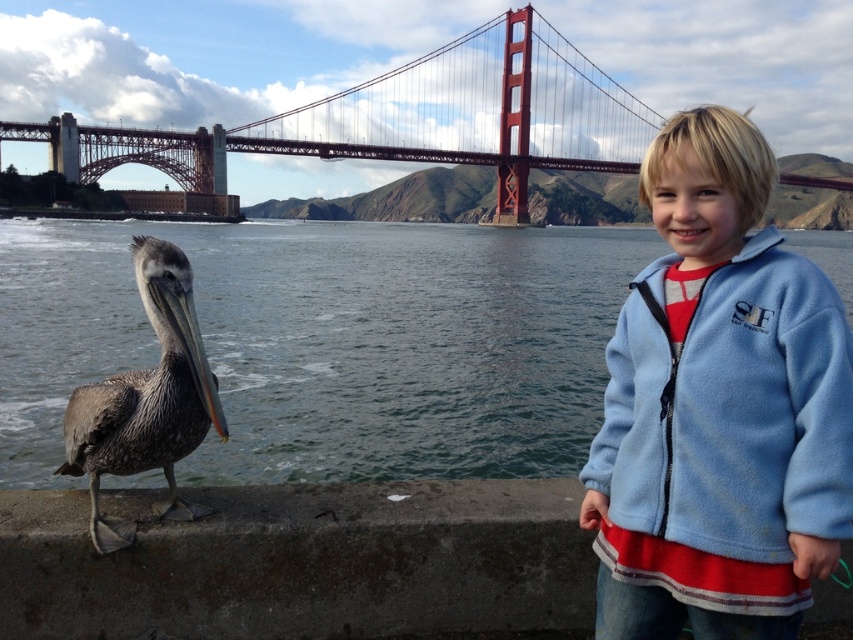
You are a photographer trying to capture the brown feathered pelican at lower left in the foreground of your shot. However, the clear water at lower left is blocking your view. Can you adjust your position to get the pelican closer to the camera without moving the pelican itself?

The clear water at lower left is further to the viewer than the brown feathered pelican at lower left, so you can move your position slightly to the right or left to position the pelican in front of the water, making it the foreground element.

You are a photographer trying to capture the Golden Gate Bridge from the scene described. You notice the clear water at lower left and the metallic red bridge at upper center. Which object is positioned higher in the image?

The metallic red bridge at upper center is positioned higher in the image than the clear water at lower left because the clear water at lower left is not as tall as the metallic red bridge at upper center.

You are standing at the Golden Gate Bridge and see the clear water at lower left and the metallic red bridge at upper center. Which object is nearer to you?

The clear water at lower left is closer to the viewer than the metallic red bridge at upper center.